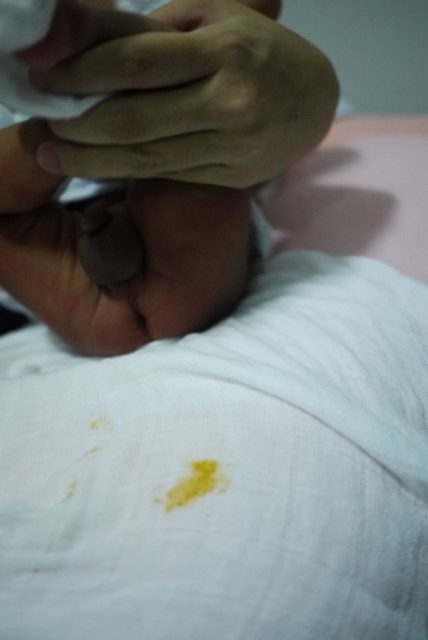
Question: Which object is closer to the camera taking this photo?

Choices:
 (A) smooth skin hand at upper center
 (B) smooth skin hand at center

Answer: (A)

Question: In this image, where is smooth skin hand at upper center located relative to smooth skin hand at center?

Choices:
 (A) above
 (B) below

Answer: (A)

Question: Is smooth skin hand at upper center to the left of smooth skin hand at center from the viewer's perspective?

Choices:
 (A) yes
 (B) no

Answer: (B)

Question: Is smooth skin hand at upper center thinner than smooth skin hand at center?

Choices:
 (A) yes
 (B) no

Answer: (A)